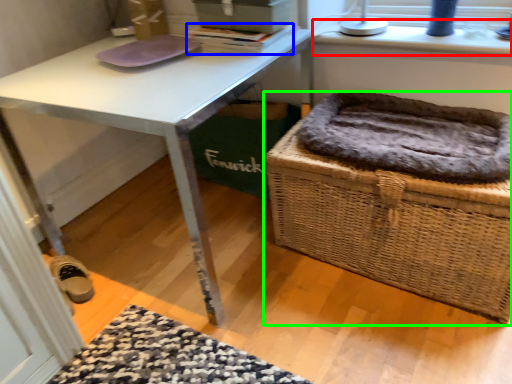
Question: Estimate the real-world distances between objects in this image. Which object is closer to window sill (highlighted by a red box), book (highlighted by a blue box) or picnic basket (highlighted by a green box)?

Choices:
 (A) book
 (B) picnic basket

Answer: (A)